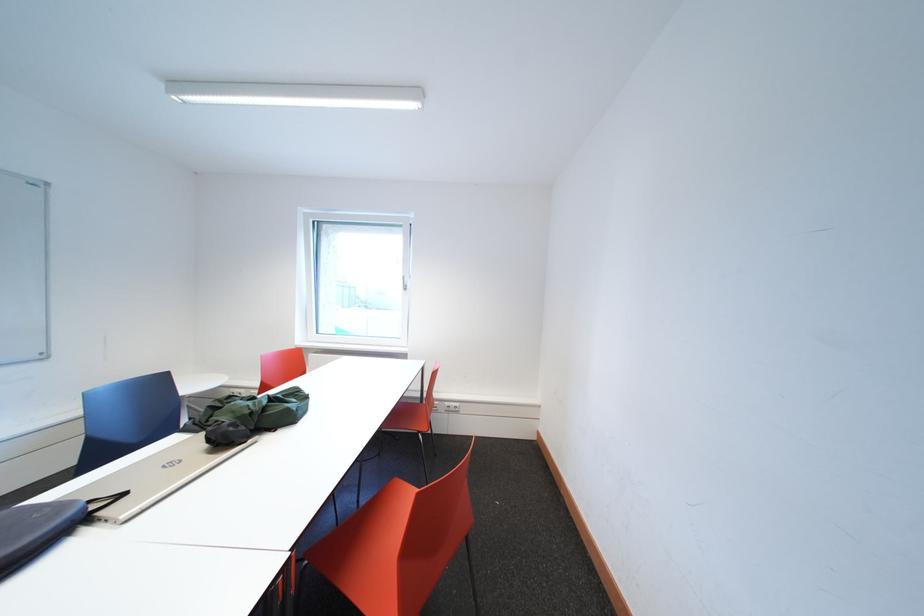
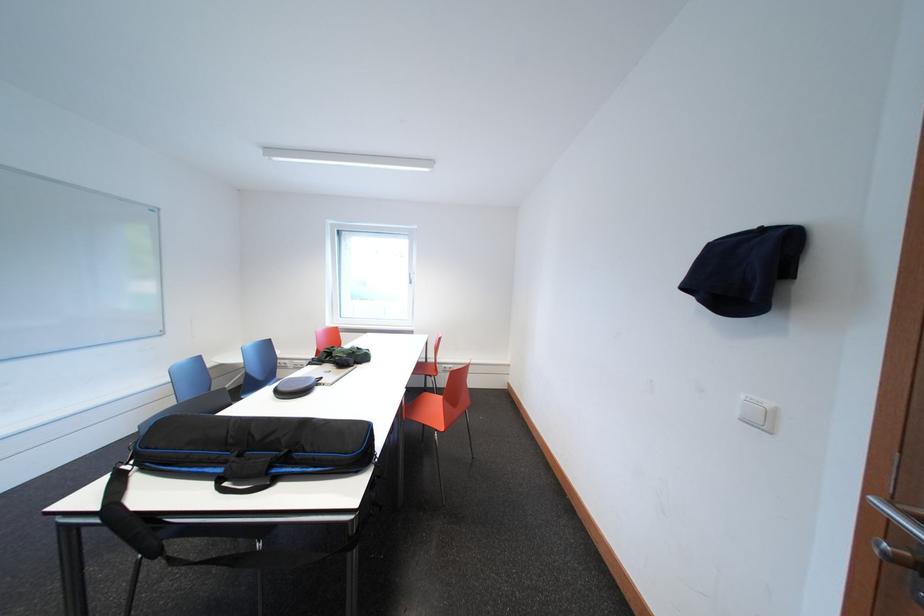
Question: Based on the continuous images, in which direction is the camera rotating? Reply with the corresponding letter.

Choices:
 (A) Left
 (B) Right
 (C) Up
 (D) Down

Answer: (B)